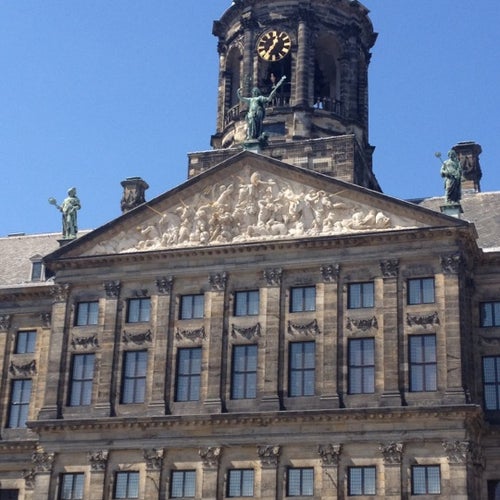
I want to click on far left statue, so click(72, 208).